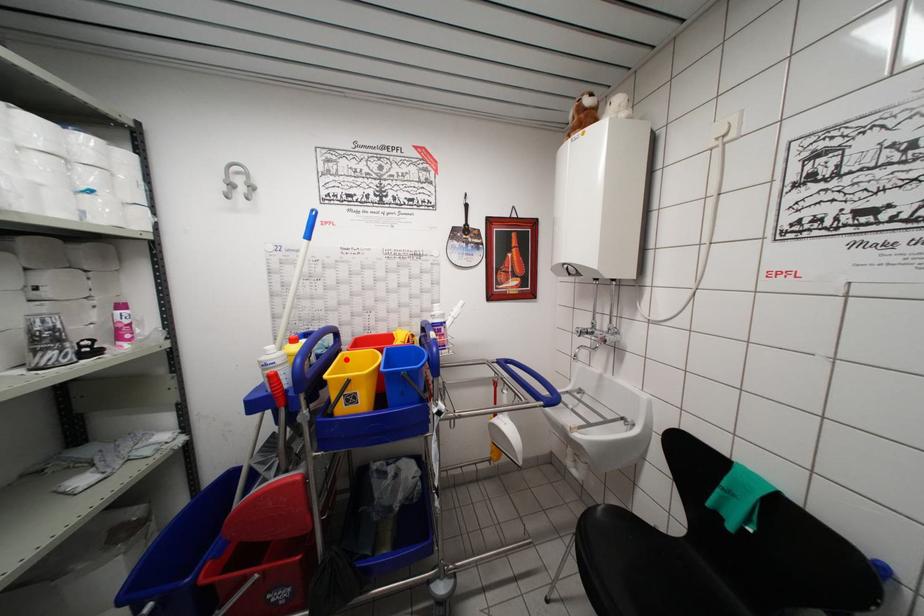
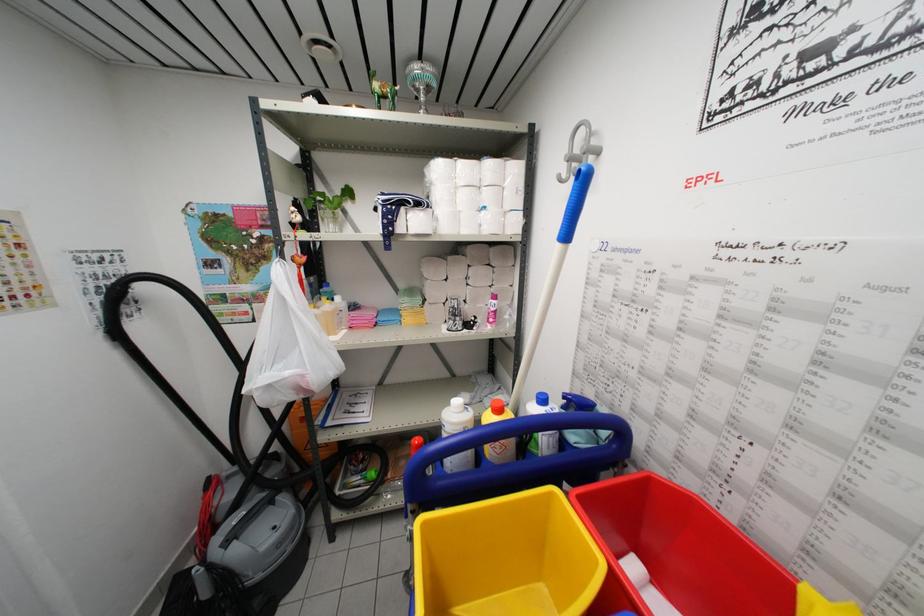
Where in the second image is the point corresponding to the highlighted location from the first image?

(554, 498)